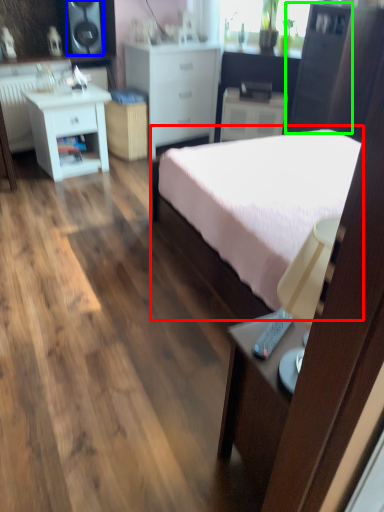
Question: Based on their relative distances, which object is nearer to bed (highlighted by a red box)? Choose from speaker (highlighted by a blue box) and cabinetry (highlighted by a green box).

Choices:
 (A) speaker
 (B) cabinetry

Answer: (B)